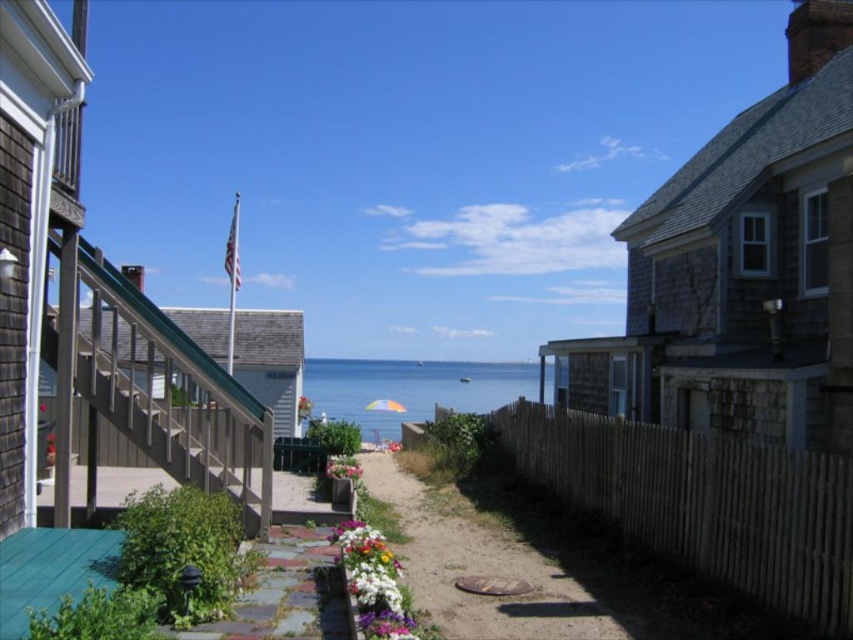
Question: Which of the following is the closest to the observer?

Choices:
 (A) (347, 522)
 (B) (334, 458)
 (C) (473, 394)
 (D) (247, 593)

Answer: (D)

Question: Does brown wooden stairs at left have a smaller size compared to blue water at center?

Choices:
 (A) no
 (B) yes

Answer: (B)

Question: Estimate the real-world distances between objects in this image. Which object is closer to the brown wooden stairs at left?

Choices:
 (A) brick paved path at lower center
 (B) white matte flowers at center

Answer: (A)

Question: Which is nearer to the brown wooden fence at lower right?

Choices:
 (A) pink fabric flower at center
 (B) brick paved path at lower center
 (C) brown wooden stairs at left

Answer: (A)

Question: Can you confirm if brick paved path at lower center is positioned below pink fabric flower at center?

Choices:
 (A) no
 (B) yes

Answer: (B)

Question: Can you confirm if brown wooden stairs at left is wider than pink fabric flower at center?

Choices:
 (A) yes
 (B) no

Answer: (A)